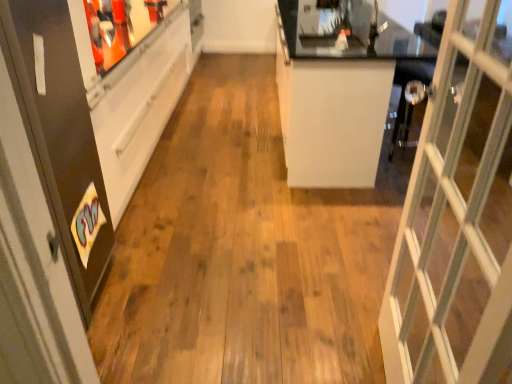
Question: Looking at their shapes, would you say white glossy counter at center is wider or thinner than matte black screen door at left?

Choices:
 (A) thin
 (B) wide

Answer: (B)

Question: Visually, is white glossy counter at center positioned to the left or to the right of matte black screen door at left?

Choices:
 (A) left
 (B) right

Answer: (B)

Question: Looking at the image, does white glossy counter at center seem bigger or smaller compared to matte black screen door at left?

Choices:
 (A) small
 (B) big

Answer: (B)

Question: Looking at their shapes, would you say matte black screen door at left is wider or thinner than white glossy counter at center?

Choices:
 (A) wide
 (B) thin

Answer: (B)

Question: Do you think matte black screen door at left is within white glossy counter at center, or outside of it?

Choices:
 (A) inside
 (B) outside

Answer: (B)

Question: Is matte black screen door at left taller or shorter than white glossy counter at center?

Choices:
 (A) short
 (B) tall

Answer: (B)

Question: From the image's perspective, relative to white glossy counter at center, is matte black screen door at left above or below?

Choices:
 (A) above
 (B) below

Answer: (B)